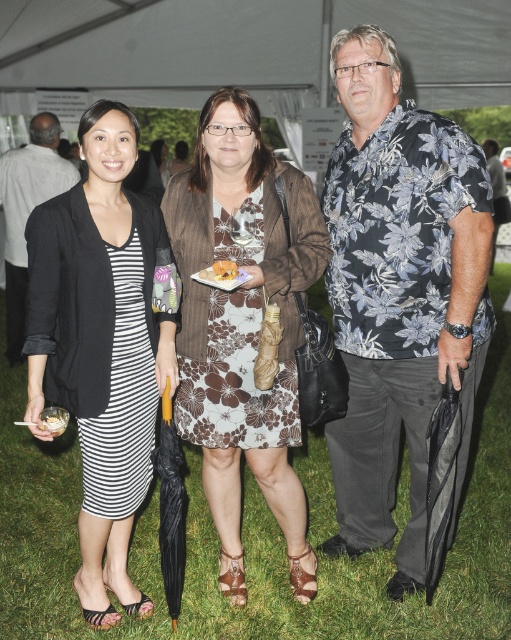
Question: Is green grass at lower center to the right of golden crispy bread at center from the viewer's perspective?

Choices:
 (A) yes
 (B) no

Answer: (A)

Question: Which object appears closest to the camera in this image?

Choices:
 (A) brown floral dress at center
 (B) black fabric jacket at upper left
 (C) green grass at lower center
 (D) golden crispy bread at center

Answer: (A)

Question: Is striped fabric dress at center closer to the viewer compared to black fabric jacket at upper left?

Choices:
 (A) no
 (B) yes

Answer: (B)

Question: Considering the real-world distances, which object is farthest from the striped fabric dress at center?

Choices:
 (A) brown floral dress at center
 (B) golden crispy bread at center
 (C) black fabric jacket at upper left
 (D) floral print shirt at center

Answer: (C)

Question: Does green grass at lower center appear over black fabric jacket at upper left?

Choices:
 (A) yes
 (B) no

Answer: (B)

Question: Which point is closer to the camera taking this photo?

Choices:
 (A) (191, 433)
 (B) (28, 348)

Answer: (B)